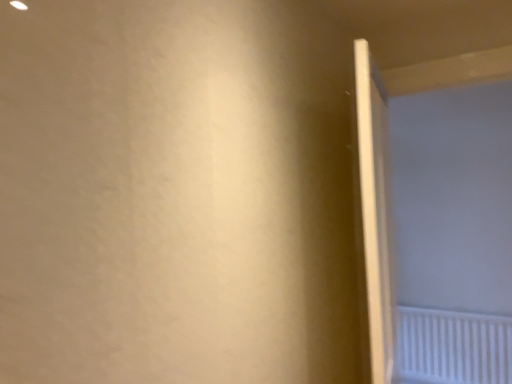
Question: From a real-world perspective, is white glossy door at right above or below white matte screen door at right?

Choices:
 (A) above
 (B) below

Answer: (B)

Question: Is point (370, 109) positioned closer to the camera than point (369, 52)?

Choices:
 (A) closer
 (B) farther

Answer: (A)

Question: Which is farther from the white plastic radiator at lower right?

Choices:
 (A) white matte screen door at right
 (B) white glossy door at right

Answer: (B)

Question: Which object is positioned closest to the white matte screen door at right?

Choices:
 (A) white glossy door at right
 (B) white plastic radiator at lower right

Answer: (B)